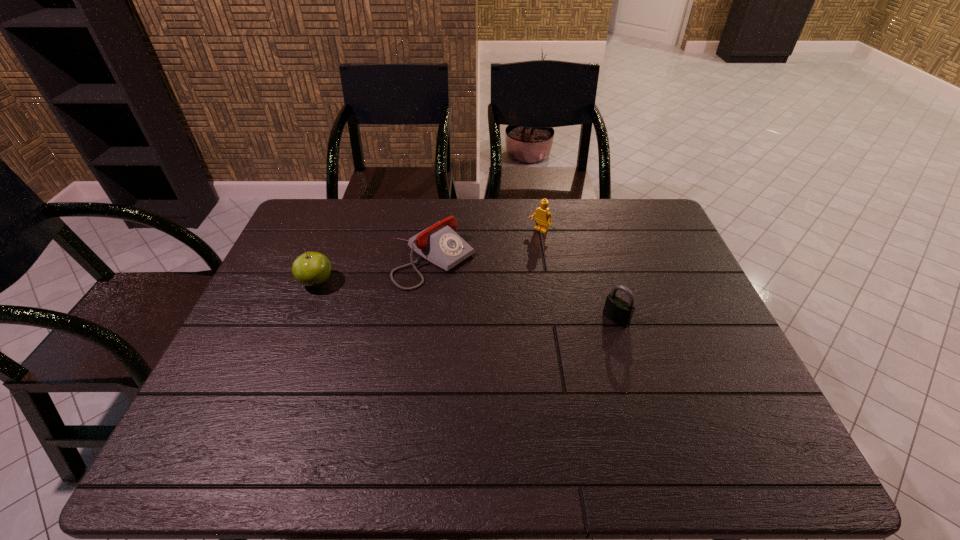
This screenshot has height=540, width=960. Identify the location of the leftmost object. (311, 269).

Where is `the nearest object`? The image size is (960, 540). the nearest object is located at coordinates (620, 312).

Image resolution: width=960 pixels, height=540 pixels. Find the location of `padlock`. padlock is located at coordinates (620, 312).

At what (x,y) coordinates should I click in order to perform the action: click on telephone. Please return your answer as a coordinate pair (x, y). Looking at the image, I should click on (440, 244).

Where is `the second object from left to right`? the second object from left to right is located at coordinates (x=440, y=244).

The height and width of the screenshot is (540, 960). Identify the location of Lego. (542, 214).

The image size is (960, 540). I want to click on blank space located 0.080m on the right of the leftmost object, so click(x=362, y=282).

The height and width of the screenshot is (540, 960). I want to click on vacant space located on the left of the padlock, so click(x=466, y=319).

Find the location of a particular element. vacant space positioned on the dial of the third object from right to left is located at coordinates (508, 309).

Identify the location of free space located on the dial of the third object from right to left. The image size is (960, 540). tap(510, 312).